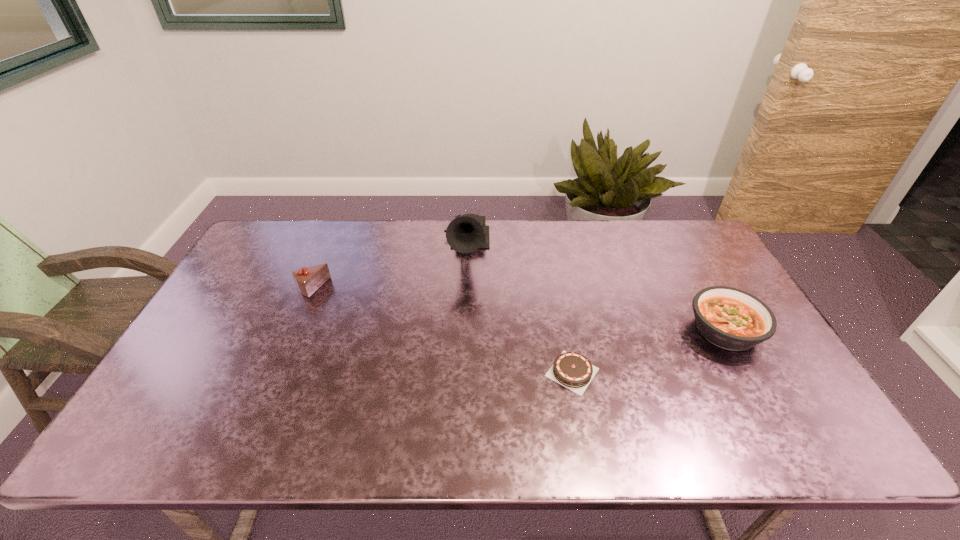
Locate which object ranks third in proximity to the right chocolate cake. Please provide its 2D coordinates. Your answer should be formatted as a tuple, i.e. [(x, y)], where the tuple contains the x and y coordinates of a point satisfying the conditions above.

[(308, 279)]

Identify the location of vacant space that satisfies the following two spatial constraints: 1. from the horn of the nearer chocolate cake; 2. on the right side of the second object from left to right. The image size is (960, 540). (462, 372).

Where is `vacant space that satisfies the following two spatial constraints: 1. on the back side of the rightmost object; 2. on the left side of the shorter chocolate cake`? The image size is (960, 540). vacant space that satisfies the following two spatial constraints: 1. on the back side of the rightmost object; 2. on the left side of the shorter chocolate cake is located at coordinates (564, 330).

Image resolution: width=960 pixels, height=540 pixels. I want to click on free point that satisfies the following two spatial constraints: 1. from the horn of the tallest object; 2. on the right side of the shortest object, so click(462, 372).

What are the coordinates of `vacant region that satisfies the following two spatial constraints: 1. from the horn of the phonograph_record; 2. on the left side of the nearer chocolate cake` in the screenshot? It's located at (462, 372).

Identify the location of free location that satisfies the following two spatial constraints: 1. from the horn of the second object from left to right; 2. on the right side of the stew. (464, 330).